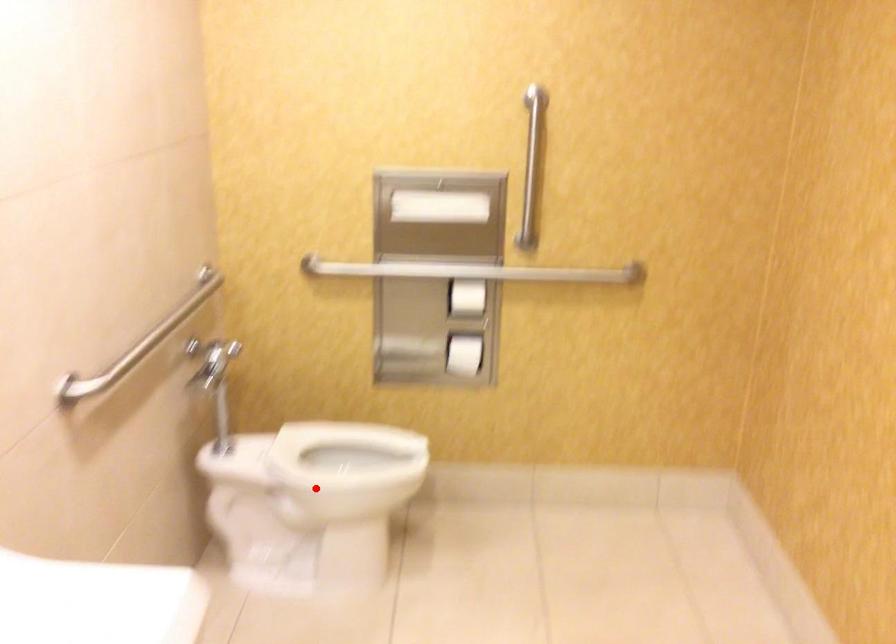
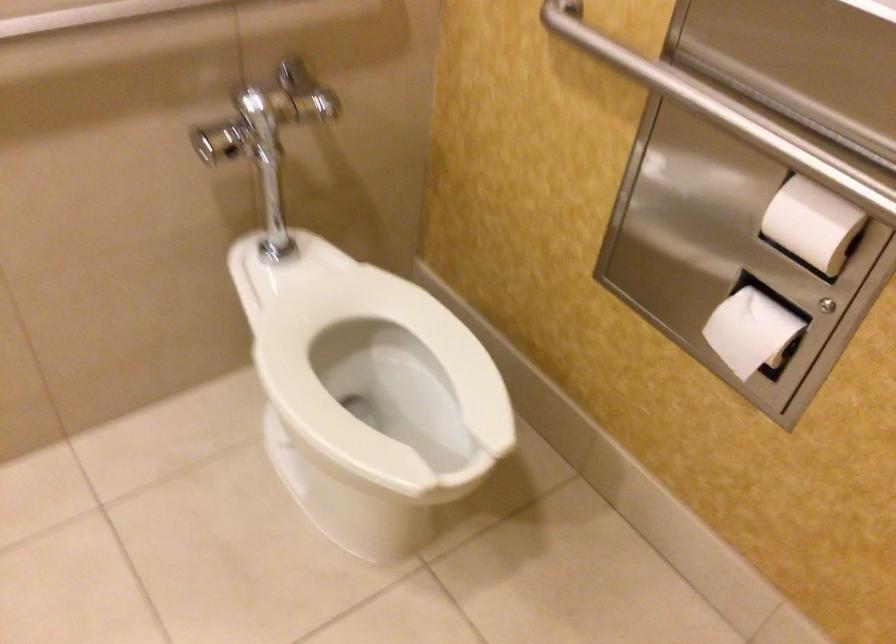
Question: I am providing you with two images of the same scene from different viewpoints. A red point is marked on the first image. Is the red point's position out of view in image 2?

Choices:
 (A) Yes
 (B) No

Answer: (B)